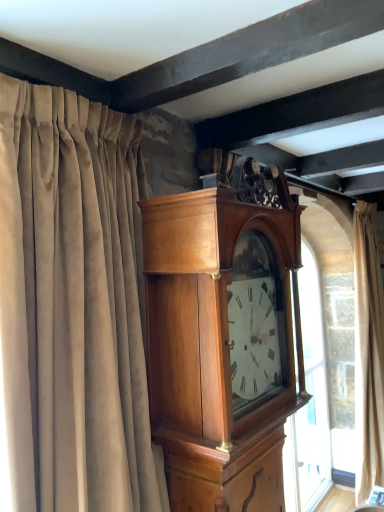
Question: Can you confirm if polished wood wall clock at center is smaller than beige velvet curtain at right, which ranks as the 2th curtain in front-to-back order?

Choices:
 (A) yes
 (B) no

Answer: (A)

Question: Is beige velvet curtain at right, arranged as the 2th curtain when viewed from the left, inside polished wood wall clock at center?

Choices:
 (A) no
 (B) yes

Answer: (A)

Question: Is polished wood wall clock at center to the left of beige velvet curtain at right, the first curtain positioned from the back, from the viewer's perspective?

Choices:
 (A) yes
 (B) no

Answer: (A)

Question: Is polished wood wall clock at center facing away from beige velvet curtain at right, which ranks as the 2th curtain in front-to-back order?

Choices:
 (A) yes
 (B) no

Answer: (B)

Question: Is polished wood wall clock at center aimed at beige velvet curtain at right, placed as the 1th curtain when sorted from right to left?

Choices:
 (A) yes
 (B) no

Answer: (B)

Question: Is suede curtain at left, which ranks as the second curtain in right-to-left order, taller or shorter than polished wood wall clock at center?

Choices:
 (A) tall
 (B) short

Answer: (B)

Question: Is suede curtain at left, acting as the 1th curtain starting from the front, bigger or smaller than polished wood wall clock at center?

Choices:
 (A) big
 (B) small

Answer: (B)

Question: From a real-world perspective, is suede curtain at left, acting as the 1th curtain starting from the front, physically located above or below polished wood wall clock at center?

Choices:
 (A) above
 (B) below

Answer: (A)

Question: Relative to polished wood wall clock at center, is suede curtain at left, acting as the 1th curtain starting from the front, in front or behind?

Choices:
 (A) behind
 (B) front

Answer: (B)

Question: Considering the positions of suede curtain at left, which ranks as the 1th curtain in left-to-right order, and beige velvet curtain at right, placed as the 1th curtain when sorted from right to left, in the image, is suede curtain at left, which ranks as the 1th curtain in left-to-right order, wider or thinner than beige velvet curtain at right, placed as the 1th curtain when sorted from right to left,?

Choices:
 (A) thin
 (B) wide

Answer: (B)

Question: Choose the correct answer: Is suede curtain at left, the second curtain viewed from the back, inside beige velvet curtain at right, arranged as the 2th curtain when viewed from the left, or outside it?

Choices:
 (A) inside
 (B) outside

Answer: (B)

Question: Visually, is suede curtain at left, the second curtain viewed from the back, positioned to the left or to the right of beige velvet curtain at right, which ranks as the 2th curtain in front-to-back order?

Choices:
 (A) right
 (B) left

Answer: (B)

Question: From the image's perspective, is suede curtain at left, the second curtain viewed from the back, positioned above or below beige velvet curtain at right, which ranks as the 2th curtain in front-to-back order?

Choices:
 (A) below
 (B) above

Answer: (B)

Question: From their relative heights in the image, would you say polished wood wall clock at center is taller or shorter than beige velvet curtain at right, placed as the 1th curtain when sorted from right to left?

Choices:
 (A) short
 (B) tall

Answer: (A)

Question: Considering the positions of polished wood wall clock at center and beige velvet curtain at right, arranged as the 2th curtain when viewed from the left, in the image, is polished wood wall clock at center bigger or smaller than beige velvet curtain at right, arranged as the 2th curtain when viewed from the left,?

Choices:
 (A) small
 (B) big

Answer: (A)